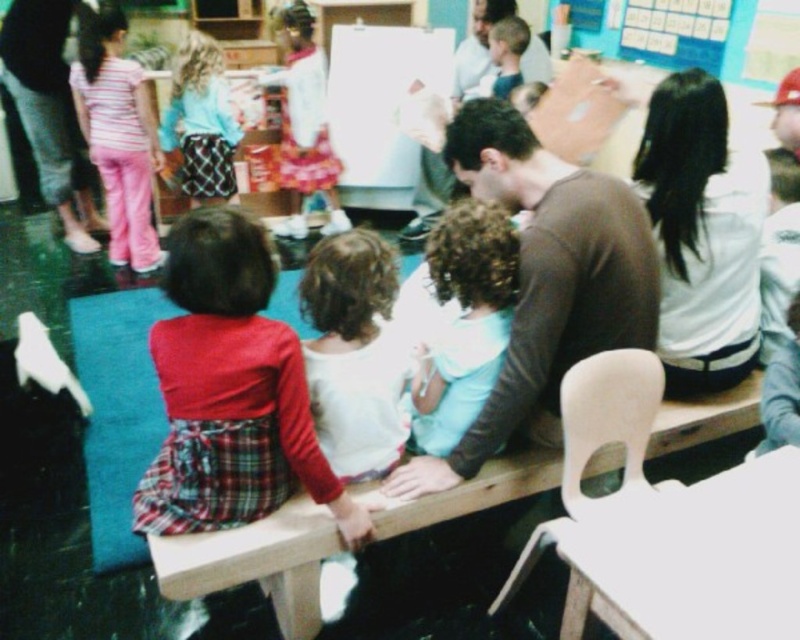
You are a teacher in the classroom and need to arrange the striped cotton shirt at upper left and the blue paperboard at upper center on a shelf. If the shelf has limited space, which item should you place first to ensure both fit?

The striped cotton shirt at upper left should be placed first since it occupies less space than the blue paperboard at upper center, allowing both items to fit on the shelf.

You are a photographer trying to capture a clear shot of both the striped cotton shirt at upper left and the blue paperboard at upper center. Based on their positions, which object will appear closer to you in the photo?

The striped cotton shirt at upper left will appear closer to you in the photo because it is positioned further to the viewer than the blue paperboard at upper center.